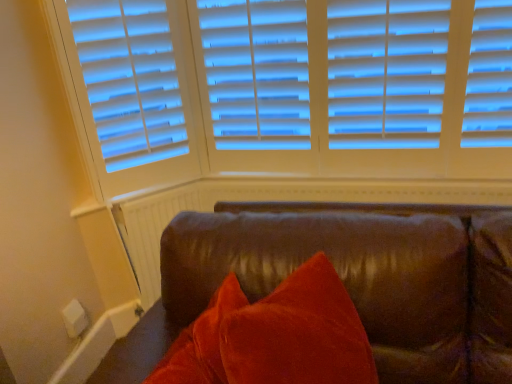
This screenshot has width=512, height=384. Describe the element at coordinates (367, 276) in the screenshot. I see `brown leather couch at lower right` at that location.

In order to face brown leather couch at lower right, should I rotate leftwards or rightwards?

You should look right and rotate roughly 11.311 degrees.

I want to click on brown leather couch at lower right, so click(x=367, y=276).

Measure the distance between brown leather couch at lower right and camera.

The depth of brown leather couch at lower right is 3.64 feet.

At what (x,y) coordinates should I click in order to perform the action: click on white textured radiator at lower left. Please return your answer as a coordinate pair (x, y). The image size is (512, 384). Looking at the image, I should click on (153, 231).

The width and height of the screenshot is (512, 384). Describe the element at coordinates (153, 231) in the screenshot. I see `white textured radiator at lower left` at that location.

You are a GUI agent. You are given a task and a screenshot of the screen. Output one action in this format:
    pyautogui.click(x=<x>, y=<y>)
    Task: Click on the brown leather couch at lower right
    The height and width of the screenshot is (384, 512).
    Given the screenshot: What is the action you would take?
    pyautogui.click(x=367, y=276)

Can you confirm if brown leather couch at lower right is positioned to the left of white textured radiator at lower left?

No.

Who is more distant, brown leather couch at lower right or white textured radiator at lower left?

white textured radiator at lower left.

Based on the photo, which is more distant, (168, 271) or (146, 275)?

The point (146, 275) is behind.

From the image's perspective, is brown leather couch at lower right located beneath white textured radiator at lower left?

Correct, brown leather couch at lower right appears lower than white textured radiator at lower left in the image.

From a real-world perspective, is brown leather couch at lower right positioned above or below white textured radiator at lower left?

Clearly, from a real-world perspective, brown leather couch at lower right is below white textured radiator at lower left.

Can you confirm if brown leather couch at lower right is thinner than white textured radiator at lower left?

In fact, brown leather couch at lower right might be wider than white textured radiator at lower left.

Is brown leather couch at lower right taller than white textured radiator at lower left?

Yes.

Which of these two, brown leather couch at lower right or white textured radiator at lower left, is smaller?

With smaller size is white textured radiator at lower left.

Is brown leather couch at lower right surrounding white textured radiator at lower left?

Actually, white textured radiator at lower left is outside brown leather couch at lower right.

Is brown leather couch at lower right touching white textured radiator at lower left?

brown leather couch at lower right and white textured radiator at lower left are not in contact.

Is brown leather couch at lower right looking in the opposite direction of white textured radiator at lower left?

brown leather couch at lower right is not turned away from white textured radiator at lower left.

In the image, there is a white textured radiator at lower left. Identify the location of studio couch below it (from a real-world perspective). The height and width of the screenshot is (384, 512). (367, 276).

Which is more to the right, white textured radiator at lower left or brown leather couch at lower right?

From the viewer's perspective, brown leather couch at lower right appears more on the right side.

Is white textured radiator at lower left further to the viewer compared to brown leather couch at lower right?

Yes, white textured radiator at lower left is further from the camera.

Is point (145, 203) positioned before point (485, 357)?

No.

From the image's perspective, between white textured radiator at lower left and brown leather couch at lower right, who is located below?

brown leather couch at lower right, from the image's perspective.

From a real-world perspective, which is physically below, white textured radiator at lower left or brown leather couch at lower right?

From a 3D spatial view, brown leather couch at lower right is below.

Which object is thinner, white textured radiator at lower left or brown leather couch at lower right?

With smaller width is white textured radiator at lower left.

Does white textured radiator at lower left have a greater height compared to brown leather couch at lower right?

No.

Who is smaller, white textured radiator at lower left or brown leather couch at lower right?

white textured radiator at lower left is smaller.

Is white textured radiator at lower left spatially inside brown leather couch at lower right, or outside of it?

white textured radiator at lower left is located beyond the bounds of brown leather couch at lower right.

Is white textured radiator at lower left beside brown leather couch at lower right?

No, white textured radiator at lower left is not with brown leather couch at lower right.

Is white textured radiator at lower left looking in the opposite direction of brown leather couch at lower right?

No, brown leather couch at lower right is not at the back of white textured radiator at lower left.

What's the angular difference between white textured radiator at lower left and brown leather couch at lower right's facing directions?

The facing directions of white textured radiator at lower left and brown leather couch at lower right are 42.2 degrees apart.

Looking at this image, how distant is white textured radiator at lower left from brown leather couch at lower right?

32.59 inches.

The width and height of the screenshot is (512, 384). Find the location of `studio couch that appears in front of the white textured radiator at lower left`. studio couch that appears in front of the white textured radiator at lower left is located at coordinates (367, 276).

Locate an element on the screen. studio couch lying on the right of white textured radiator at lower left is located at coordinates (367, 276).

Identify the location of studio couch below the white textured radiator at lower left (from the image's perspective). The width and height of the screenshot is (512, 384). (367, 276).